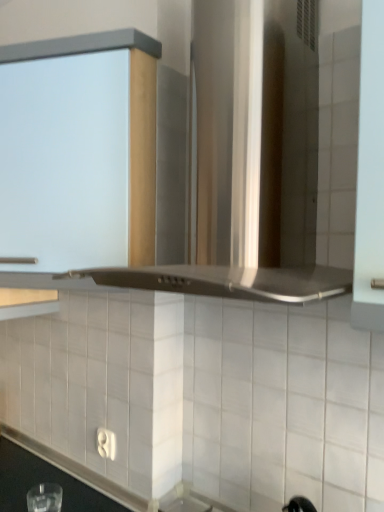
Question: Considering the relative positions of white matte cabinet at upper left and stainless steel vent at center in the image provided, is white matte cabinet at upper left to the right of stainless steel vent at center from the viewer's perspective?

Choices:
 (A) no
 (B) yes

Answer: (A)

Question: Can we say white matte cabinet at upper left lies outside stainless steel vent at center?

Choices:
 (A) yes
 (B) no

Answer: (A)

Question: From a real-world perspective, is white matte cabinet at upper left on top of stainless steel vent at center?

Choices:
 (A) no
 (B) yes

Answer: (A)

Question: Is white matte cabinet at upper left aimed at stainless steel vent at center?

Choices:
 (A) yes
 (B) no

Answer: (B)

Question: Does white matte cabinet at upper left lie in front of stainless steel vent at center?

Choices:
 (A) no
 (B) yes

Answer: (A)

Question: From a real-world perspective, is white matte cabinet at upper left below stainless steel vent at center?

Choices:
 (A) no
 (B) yes

Answer: (B)

Question: From a real-world perspective, is stainless steel vent at center on white matte cabinet at upper left?

Choices:
 (A) yes
 (B) no

Answer: (A)

Question: Considering the relative sizes of stainless steel vent at center and white matte cabinet at upper left in the image provided, is stainless steel vent at center smaller than white matte cabinet at upper left?

Choices:
 (A) no
 (B) yes

Answer: (A)

Question: Considering the relative sizes of stainless steel vent at center and white matte cabinet at upper left in the image provided, is stainless steel vent at center taller than white matte cabinet at upper left?

Choices:
 (A) yes
 (B) no

Answer: (A)

Question: Is stainless steel vent at center thinner than white matte cabinet at upper left?

Choices:
 (A) yes
 (B) no

Answer: (B)

Question: Does stainless steel vent at center have a lesser height compared to white matte cabinet at upper left?

Choices:
 (A) no
 (B) yes

Answer: (A)

Question: From the image's perspective, would you say stainless steel vent at center is shown under white matte cabinet at upper left?

Choices:
 (A) yes
 (B) no

Answer: (B)

Question: In the image, is stainless steel vent at center positioned in front of or behind white matte cabinet at upper left?

Choices:
 (A) behind
 (B) front

Answer: (B)